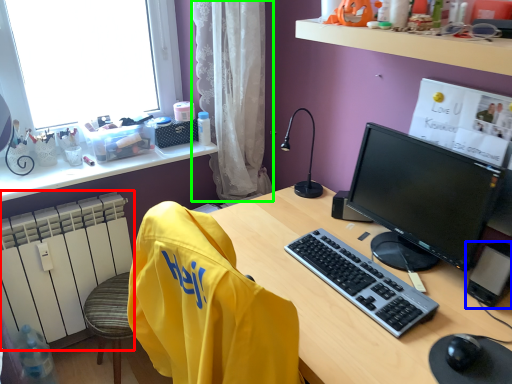
Question: Based on their relative distances, which object is farther from radiator (highlighted by a red box)? Choose from computer tower (highlighted by a blue box) and curtain (highlighted by a green box).

Choices:
 (A) computer tower
 (B) curtain

Answer: (A)